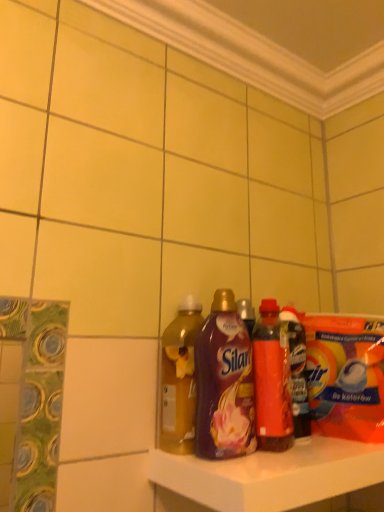
Question: Considering the relative sizes of translucent plastic bottle at center, placed as the 1th bottle when sorted from right to left, and purple plastic bottle at center, which ranks as the 3th bottle in right-to-left order, in the image provided, is translucent plastic bottle at center, placed as the 1th bottle when sorted from right to left, bigger than purple plastic bottle at center, which ranks as the 3th bottle in right-to-left order,?

Choices:
 (A) no
 (B) yes

Answer: (A)

Question: Does translucent plastic bottle at center, which is counted as the 4th bottle, starting from the left, lie in front of purple plastic bottle at center, which ranks as the 3th bottle in right-to-left order?

Choices:
 (A) yes
 (B) no

Answer: (B)

Question: Are translucent plastic bottle at center, which is counted as the 4th bottle, starting from the left, and purple plastic bottle at center, which ranks as the 3th bottle in right-to-left order, beside each other?

Choices:
 (A) no
 (B) yes

Answer: (A)

Question: Is purple plastic bottle at center, which ranks as the 3th bottle in right-to-left order, inside translucent plastic bottle at center, which is counted as the 4th bottle, starting from the left?

Choices:
 (A) yes
 (B) no

Answer: (B)

Question: Is translucent plastic bottle at center, which is counted as the 4th bottle, starting from the left, positioned with its back to purple plastic bottle at center, which ranks as the 3th bottle in right-to-left order?

Choices:
 (A) yes
 (B) no

Answer: (B)

Question: From the image's perspective, relative to translucent plastic bottle at center, which is counted as the 4th bottle, starting from the left, is shiny plastic bottle at center, the third bottle when ordered from left to right, above or below?

Choices:
 (A) above
 (B) below

Answer: (A)

Question: Do you think shiny plastic bottle at center, the third bottle when ordered from left to right, is within translucent plastic bottle at center, placed as the 1th bottle when sorted from right to left, or outside of it?

Choices:
 (A) outside
 (B) inside

Answer: (A)

Question: From their relative heights in the image, would you say shiny plastic bottle at center, the 2th bottle when ordered from right to left, is taller or shorter than translucent plastic bottle at center, placed as the 1th bottle when sorted from right to left?

Choices:
 (A) tall
 (B) short

Answer: (A)

Question: Considering their positions, is shiny plastic bottle at center, the 2th bottle when ordered from right to left, located in front of or behind translucent plastic bottle at center, placed as the 1th bottle when sorted from right to left?

Choices:
 (A) behind
 (B) front

Answer: (B)

Question: Is point (175, 338) closer or farther from the camera than point (274, 359)?

Choices:
 (A) farther
 (B) closer

Answer: (A)

Question: In the image, is translucent yellow liquid at center, placed as the first bottle when sorted from left to right, on the left side or the right side of shiny plastic bottle at center, the third bottle when ordered from left to right?

Choices:
 (A) right
 (B) left

Answer: (B)

Question: Based on their sizes in the image, would you say translucent yellow liquid at center, placed as the first bottle when sorted from left to right, is bigger or smaller than shiny plastic bottle at center, the 2th bottle when ordered from right to left?

Choices:
 (A) big
 (B) small

Answer: (B)

Question: Is translucent yellow liquid at center, arranged as the 4th bottle when viewed from the right, inside or outside of shiny plastic bottle at center, the third bottle when ordered from left to right?

Choices:
 (A) outside
 (B) inside

Answer: (A)

Question: Considering the positions of shiny plastic bottle at center, the third bottle when ordered from left to right, and purple plastic bottle at center, the second bottle in the left-to-right sequence, in the image, is shiny plastic bottle at center, the third bottle when ordered from left to right, wider or thinner than purple plastic bottle at center, the second bottle in the left-to-right sequence,?

Choices:
 (A) wide
 (B) thin

Answer: (A)

Question: From a real-world perspective, is shiny plastic bottle at center, the third bottle when ordered from left to right, above or below purple plastic bottle at center, which ranks as the 3th bottle in right-to-left order?

Choices:
 (A) below
 (B) above

Answer: (A)